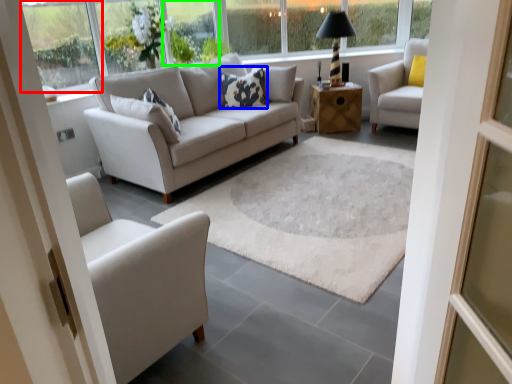
Question: Which object is the closest to the window (highlighted by a red box)? Choose among these: pillow (highlighted by a blue box) or window (highlighted by a green box).

Choices:
 (A) pillow
 (B) window

Answer: (B)